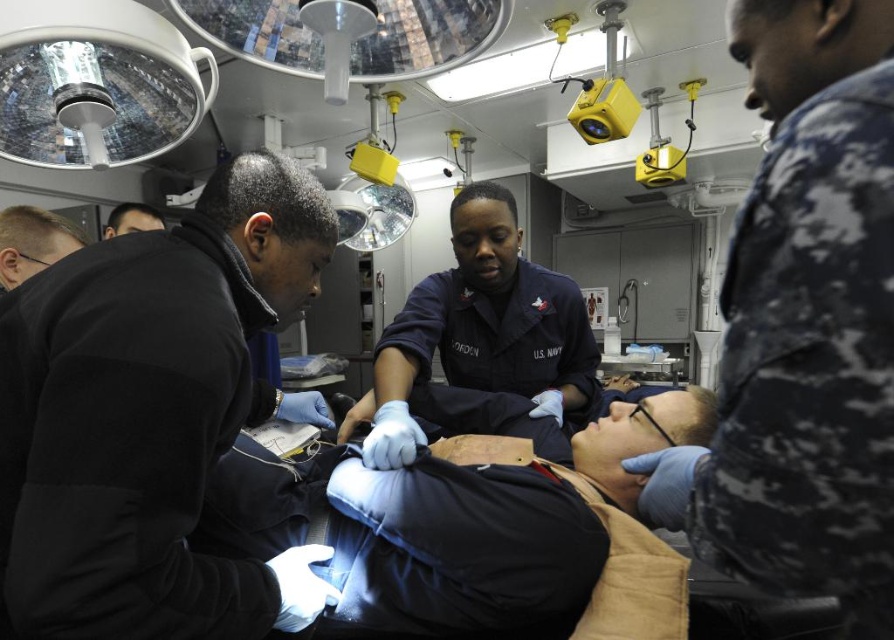
Question: Which point is farther to the camera?

Choices:
 (A) dark blue uniform at center
 (B) black matte jacket at left
 (C) camouflage uniform at center

Answer: (A)

Question: Is black matte jacket at left behind camouflage uniform at center?

Choices:
 (A) no
 (B) yes

Answer: (B)

Question: Can you confirm if black matte jacket at left is positioned to the left of camouflage uniform at center?

Choices:
 (A) no
 (B) yes

Answer: (B)

Question: Which point appears closest to the camera in this image?

Choices:
 (A) [492, 285]
 (B) [793, 314]
 (C) [268, 394]

Answer: (B)

Question: Does black matte jacket at left have a larger size compared to camouflage uniform at center?

Choices:
 (A) no
 (B) yes

Answer: (B)

Question: Among these points, which one is farthest from the camera?

Choices:
 (A) (164, 342)
 (B) (799, 320)

Answer: (A)